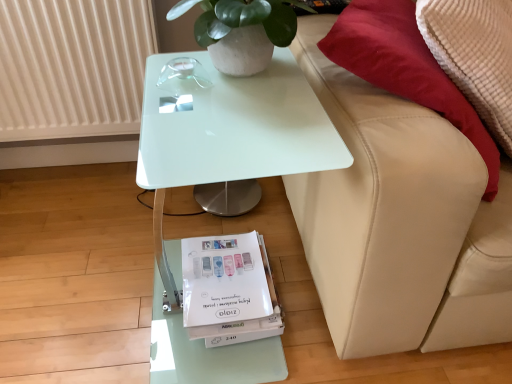
What do you see at coordinates (73, 67) in the screenshot?
I see `white ribbed radiator at upper left` at bounding box center [73, 67].

From the picture: What is the approximate height of white ribbed radiator at upper left?

It is 18.61 inches.

This screenshot has width=512, height=384. What do you see at coordinates (224, 280) in the screenshot?
I see `white paper magazine at lower center` at bounding box center [224, 280].

At what (x,y) coordinates should I click in order to perform the action: click on beige leather couch at right. Please return your answer as a coordinate pair (x, y). This screenshot has width=512, height=384. Looking at the image, I should click on (400, 221).

The image size is (512, 384). Describe the element at coordinates (400, 221) in the screenshot. I see `beige leather couch at right` at that location.

Locate an element on the screen. The image size is (512, 384). white matte pot at upper center is located at coordinates (242, 31).

I want to click on white ribbed radiator at upper left, so point(73,67).

Does white glossy table at center turn towards white paper magazine at lower center?

No, white glossy table at center is not aimed at white paper magazine at lower center.

Which point is more forward, (153, 150) or (237, 273)?

The point (153, 150) is closer.

Is white glossy table at center not close to white paper magazine at lower center?

Actually, white glossy table at center and white paper magazine at lower center are a little close together.

Is white matte pot at upper center far away from white glossy table at center?

white matte pot at upper center is near white glossy table at center, not far away.

From a real-world perspective, which is physically below, white matte pot at upper center or white glossy table at center?

From a 3D spatial view, white glossy table at center is below.

Do you think white matte pot at upper center is within white glossy table at center, or outside of it?

white matte pot at upper center is spatially situated outside white glossy table at center.

Based on the photo, does beige leather couch at right have a greater width compared to white matte pot at upper center?

Correct, the width of beige leather couch at right exceeds that of white matte pot at upper center.

Visually, is beige leather couch at right positioned to the left or to the right of white matte pot at upper center?

Clearly, beige leather couch at right is on the right of white matte pot at upper center in the image.

From the image's perspective, which is above, beige leather couch at right or white matte pot at upper center?

white matte pot at upper center appears higher in the image.

In the scene shown: Is white ribbed radiator at upper left beside white paper magazine at lower center?

No, white ribbed radiator at upper left is not next to white paper magazine at lower center.

Identify the location of radiator behind the white paper magazine at lower center. 73,67.

Is point (131, 77) less distant than point (238, 289)?

No.

Based on their sizes in the image, would you say white ribbed radiator at upper left is bigger or smaller than white paper magazine at lower center?

white ribbed radiator at upper left is bigger than white paper magazine at lower center.

Looking at the image, does white matte pot at upper center seem bigger or smaller compared to white ribbed radiator at upper left?

In the image, white matte pot at upper center appears to be smaller than white ribbed radiator at upper left.

Are white matte pot at upper center and white ribbed radiator at upper left far apart?

No, white matte pot at upper center is not far away from white ribbed radiator at upper left.

Considering the points (223, 14) and (98, 26), which point is behind, point (223, 14) or point (98, 26)?

Positioned behind is point (98, 26).

Considering the sizes of objects white matte pot at upper center and white ribbed radiator at upper left in the image provided, who is thinner, white matte pot at upper center or white ribbed radiator at upper left?

Thinner between the two is white ribbed radiator at upper left.

Can you confirm if white paper magazine at lower center is smaller than beige leather couch at right?

Yes, white paper magazine at lower center is smaller than beige leather couch at right.

You are a GUI agent. You are given a task and a screenshot of the screen. Output one action in this format:
    pyautogui.click(x=<x>, y=<y>)
    Task: Click on the magazine to the left of beige leather couch at right
    
    Given the screenshot: What is the action you would take?
    tap(224, 280)

Can you confirm if white paper magazine at lower center is wider than beige leather couch at right?

In fact, white paper magazine at lower center might be narrower than beige leather couch at right.

Does beige leather couch at right have a lesser height compared to white ribbed radiator at upper left?

In fact, beige leather couch at right may be taller than white ribbed radiator at upper left.

From the image's perspective, which object appears higher, beige leather couch at right or white ribbed radiator at upper left?

From the image's view, white ribbed radiator at upper left is above.

Is beige leather couch at right to the left of white ribbed radiator at upper left from the viewer's perspective?

No.

You are a GUI agent. You are given a task and a screenshot of the screen. Output one action in this format:
    pyautogui.click(x=<x>, y=<y>)
    Task: Click on the table located above the white paper magazine at lower center (from a real-world perspective)
    The image size is (512, 384).
    Given the screenshot: What is the action you would take?
    click(x=234, y=127)

Find the location of a particular element. This screenshot has width=512, height=384. houseplant on the right of white glossy table at center is located at coordinates (242, 31).

From the image, which object appears to be nearer to white paper magazine at lower center, white glossy table at center or white ribbed radiator at upper left?

white glossy table at center is closer to white paper magazine at lower center.

Estimate the real-world distances between objects in this image. Which object is further from white paper magazine at lower center, white ribbed radiator at upper left or beige leather couch at right?

Among the two, white ribbed radiator at upper left is located further to white paper magazine at lower center.

When comparing their distances from white matte pot at upper center, does beige leather couch at right or white ribbed radiator at upper left seem closer?

beige leather couch at right is closer to white matte pot at upper center.

In the scene shown: Which object lies further to the anchor point white matte pot at upper center, white glossy table at center or white ribbed radiator at upper left?

white ribbed radiator at upper left is further to white matte pot at upper center.

Looking at this image, when comparing their distances from beige leather couch at right, does white ribbed radiator at upper left or white paper magazine at lower center seem closer?

white paper magazine at lower center is closer to beige leather couch at right.

Which object lies further to the anchor point white glossy table at center, white matte pot at upper center or white paper magazine at lower center?

white paper magazine at lower center is further to white glossy table at center.

Considering their positions, is white glossy table at center positioned closer to beige leather couch at right than white ribbed radiator at upper left?

white glossy table at center is positioned closer to the anchor beige leather couch at right.

Based on their spatial positions, is beige leather couch at right or white glossy table at center closer to white matte pot at upper center?

Based on the image, white glossy table at center appears to be nearer to white matte pot at upper center.

Locate an element on the screen. The width and height of the screenshot is (512, 384). houseplant that lies between white ribbed radiator at upper left and white paper magazine at lower center from top to bottom is located at coordinates (242, 31).

Locate an element on the screen. table between white matte pot at upper center and white paper magazine at lower center from top to bottom is located at coordinates (234, 127).

Find the location of a particular element. The image size is (512, 384). houseplant between white ribbed radiator at upper left and beige leather couch at right is located at coordinates (242, 31).

This screenshot has height=384, width=512. What are the coordinates of `magazine between white ribbed radiator at upper left and beige leather couch at right in the horizontal direction` in the screenshot? It's located at (224, 280).